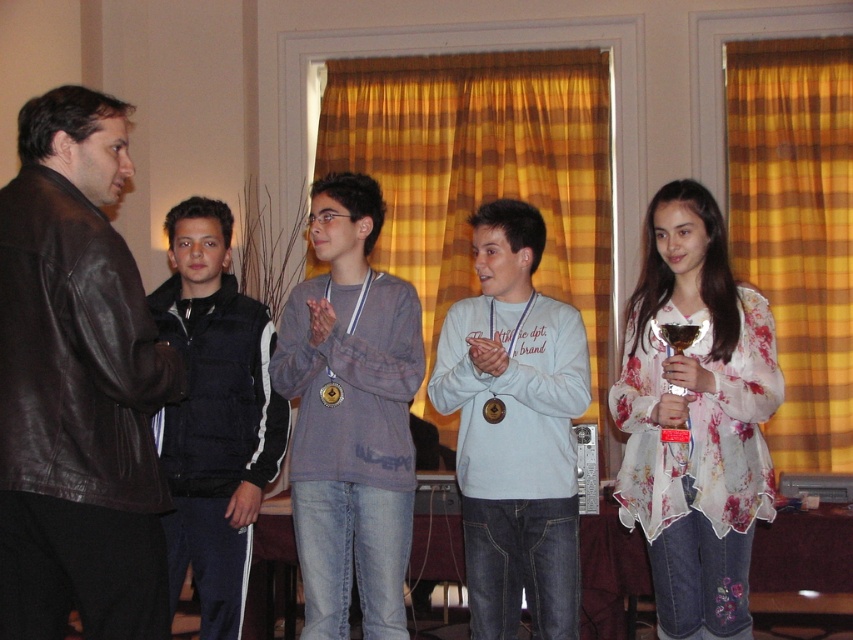
Question: Among these points, which one is nearest to the camera?

Choices:
 (A) (544, 560)
 (B) (392, 634)
 (C) (73, 396)

Answer: (C)

Question: Does brown leather jacket at left appear on the right side of black synthetic jacket at left?

Choices:
 (A) yes
 (B) no

Answer: (B)

Question: Where is floral sheer blouse at center located in relation to matte gray sweater at center in the image?

Choices:
 (A) below
 (B) above

Answer: (A)

Question: Can you confirm if matte gray sweater at center is smaller than black synthetic jacket at left?

Choices:
 (A) yes
 (B) no

Answer: (B)

Question: Which point is closer to the camera?

Choices:
 (A) matte gray sweater at center
 (B) light blue cotton shirt at center
 (C) brown leather jacket at left

Answer: (C)

Question: Which point is farther to the camera?

Choices:
 (A) light blue cotton shirt at center
 (B) floral sheer blouse at center

Answer: (A)